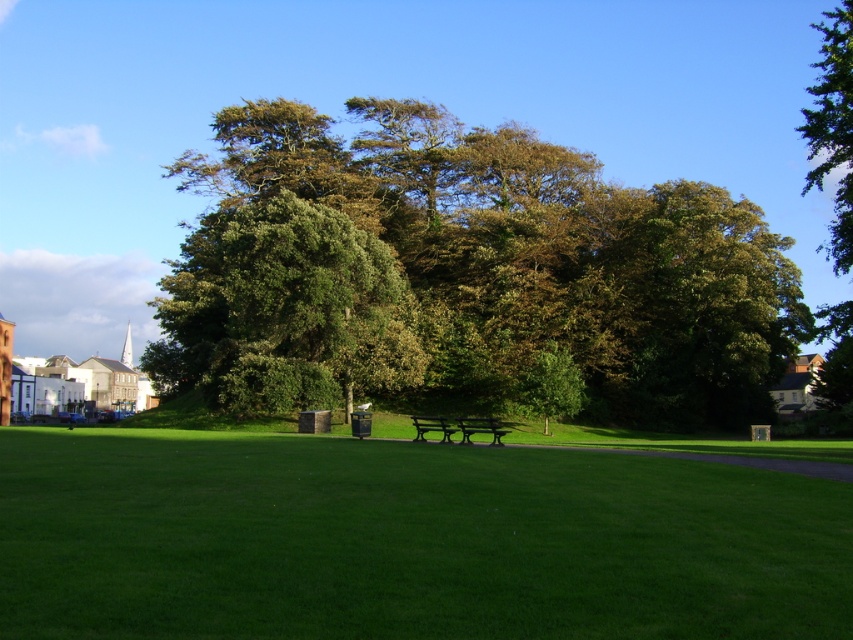
Is green grass at center wider than metallic green bench at center?

Yes.

Does green grass at center have a lesser height compared to metallic green bench at center?

Yes, green grass at center is shorter than metallic green bench at center.

Does point (537, 529) lie behind point (485, 422)?

No, it is in front of (485, 422).

Identify the location of green grass at center. The image size is (853, 640). (405, 540).

Can you confirm if metallic green bench at center is positioned above green wooden bench at center?

Correct, metallic green bench at center is located above green wooden bench at center.

Is metallic green bench at center to the left of green wooden bench at center from the viewer's perspective?

Incorrect, metallic green bench at center is not on the left side of green wooden bench at center.

Who is more forward, (x=474, y=419) or (x=421, y=432)?

Point (x=421, y=432)

Where is `metallic green bench at center`? metallic green bench at center is located at coordinates (457, 428).

Does green grass at center have a greater height compared to green leafy tree at upper right?

Incorrect, green grass at center's height is not larger of green leafy tree at upper right's.

This screenshot has width=853, height=640. What do you see at coordinates (405, 540) in the screenshot?
I see `green grass at center` at bounding box center [405, 540].

The image size is (853, 640). I want to click on green grass at center, so 405,540.